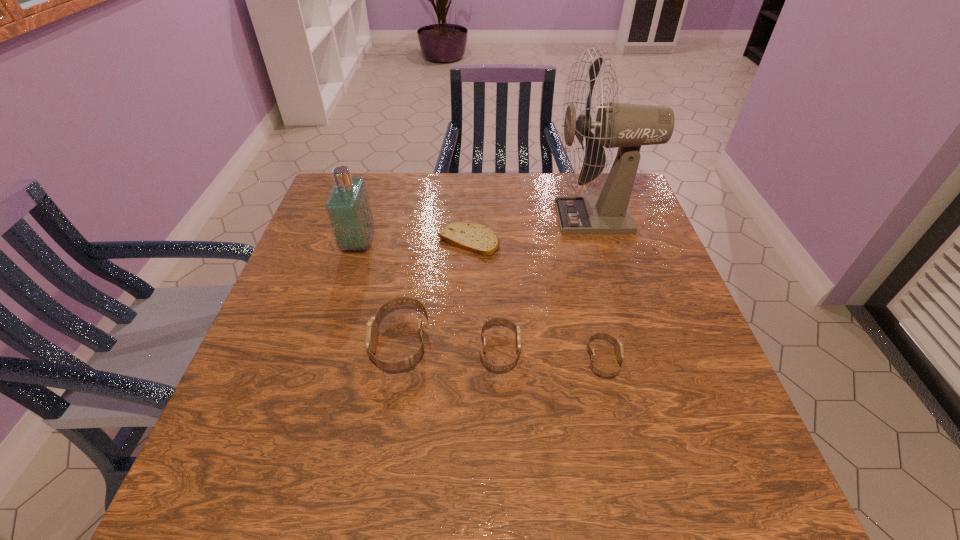
Find the location of a particular element. This screenshot has width=960, height=540. free space that satisfies the following two spatial constraints: 1. on the front side of the pita bread; 2. on the face of the tallest watch is located at coordinates (466, 342).